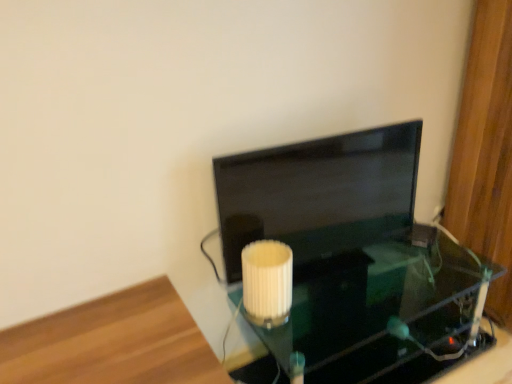
Question: Does white ribbed lampshade at center contain matte black monitor at center?

Choices:
 (A) yes
 (B) no

Answer: (B)

Question: From the image's perspective, would you say white ribbed lampshade at center is positioned over matte black monitor at center?

Choices:
 (A) no
 (B) yes

Answer: (A)

Question: Considering the relative positions of white ribbed lampshade at center and matte black monitor at center in the image provided, is white ribbed lampshade at center to the right of matte black monitor at center from the viewer's perspective?

Choices:
 (A) yes
 (B) no

Answer: (B)

Question: Does white ribbed lampshade at center have a greater height compared to matte black monitor at center?

Choices:
 (A) yes
 (B) no

Answer: (B)

Question: Does white ribbed lampshade at center have a lesser width compared to matte black monitor at center?

Choices:
 (A) yes
 (B) no

Answer: (B)

Question: From the image's perspective, is matte black monitor at center located above or below white ribbed lampshade at center?

Choices:
 (A) above
 (B) below

Answer: (A)

Question: Is point (315, 157) positioned closer to the camera than point (246, 296)?

Choices:
 (A) farther
 (B) closer

Answer: (A)

Question: Considering the positions of matte black monitor at center and white ribbed lampshade at center in the image, is matte black monitor at center wider or thinner than white ribbed lampshade at center?

Choices:
 (A) thin
 (B) wide

Answer: (A)

Question: Is matte black monitor at center spatially inside white ribbed lampshade at center, or outside of it?

Choices:
 (A) outside
 (B) inside

Answer: (A)

Question: Is wooden floor at lower left in front of or behind white ribbed lampshade at center in the image?

Choices:
 (A) behind
 (B) front

Answer: (B)

Question: Is wooden floor at lower left wider or thinner than white ribbed lampshade at center?

Choices:
 (A) wide
 (B) thin

Answer: (A)

Question: Based on their positions, is wooden floor at lower left located to the left or right of white ribbed lampshade at center?

Choices:
 (A) right
 (B) left

Answer: (B)

Question: From the image's perspective, is wooden floor at lower left located above or below white ribbed lampshade at center?

Choices:
 (A) below
 (B) above

Answer: (A)

Question: From a real-world perspective, is transparent glass table at center above or below white ribbed lampshade at center?

Choices:
 (A) below
 (B) above

Answer: (A)

Question: Is transparent glass table at center inside or outside of white ribbed lampshade at center?

Choices:
 (A) inside
 (B) outside

Answer: (B)